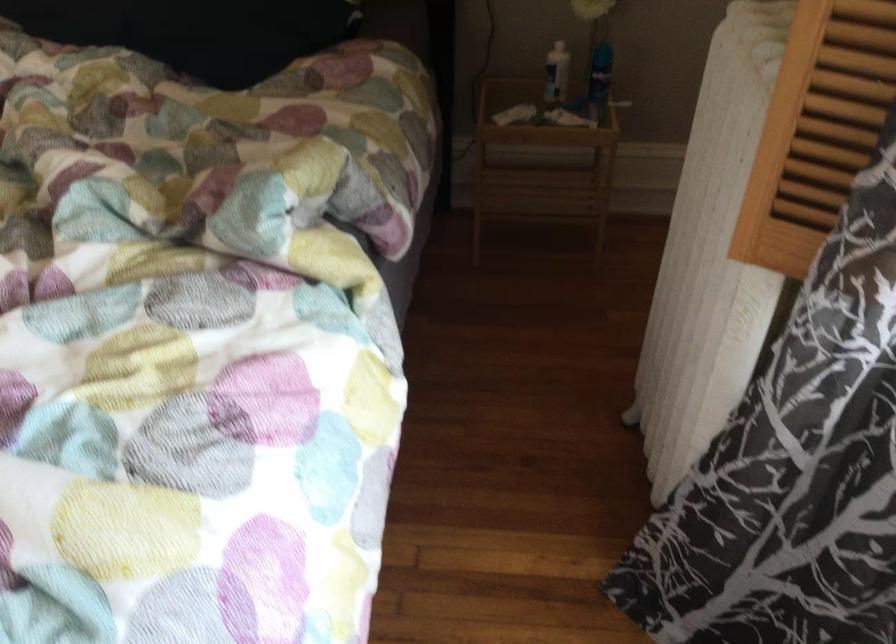
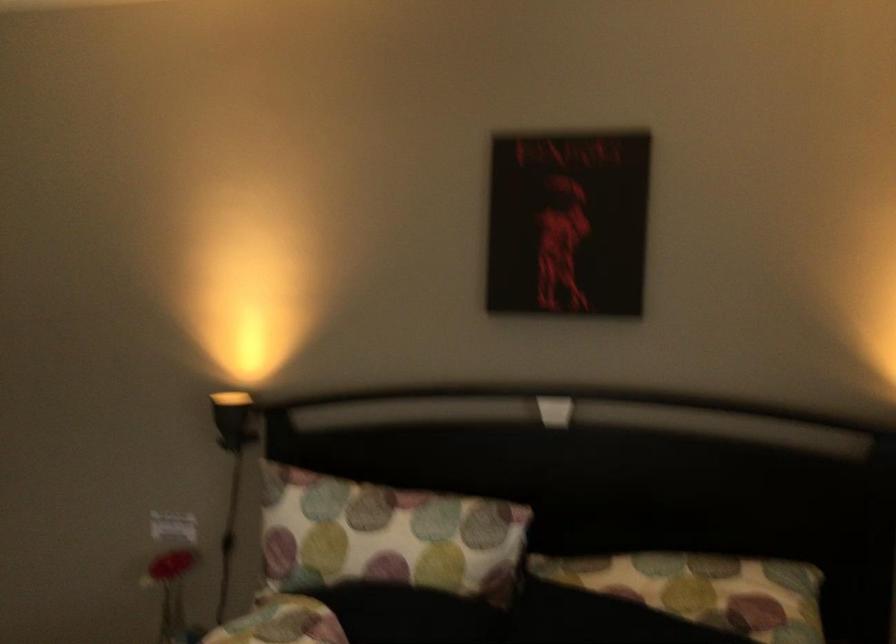
Question: The images are taken continuously from a first-person perspective. In which direction is your viewpoint rotating?

Choices:
 (A) Left
 (B) Right
 (C) Up
 (D) Down

Answer: (C)